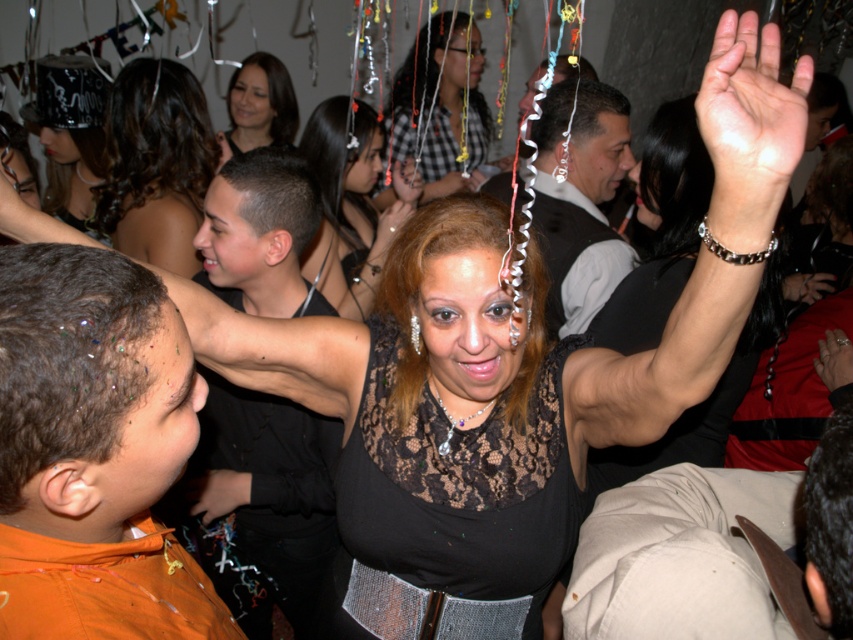
Can you confirm if orange fabric shirt at left is positioned below shiny black shirt at center?

Incorrect, orange fabric shirt at left is not positioned below shiny black shirt at center.

Is point (76, 522) farther from camera compared to point (276, 193)?

No.

Between point (6, 417) and point (236, 225), which one is positioned behind?

The point (236, 225) is more distant.

Find the location of `orange fabric shirt at left`. orange fabric shirt at left is located at coordinates (91, 449).

This screenshot has width=853, height=640. What do you see at coordinates (579, 198) in the screenshot?
I see `matte black vest at center` at bounding box center [579, 198].

Looking at this image, does matte black vest at center have a smaller size compared to black lace dress at center?

Yes.

This screenshot has height=640, width=853. Describe the element at coordinates (579, 198) in the screenshot. I see `matte black vest at center` at that location.

You are a GUI agent. You are given a task and a screenshot of the screen. Output one action in this format:
    pyautogui.click(x=<x>, y=<y>)
    Task: Click on the matte black vest at center
    The image size is (853, 640).
    Given the screenshot: What is the action you would take?
    pyautogui.click(x=579, y=198)

Which is more to the right, black lace dress at center or black shiny hat at upper left?

black lace dress at center is more to the right.

Who is shorter, black lace dress at center or black shiny hat at upper left?

black shiny hat at upper left

Locate an element on the screen. black lace dress at center is located at coordinates (350, 205).

At what (x,y) coordinates should I click in order to perform the action: click on black lace dress at center. Please return your answer as a coordinate pair (x, y). Looking at the image, I should click on (350, 205).